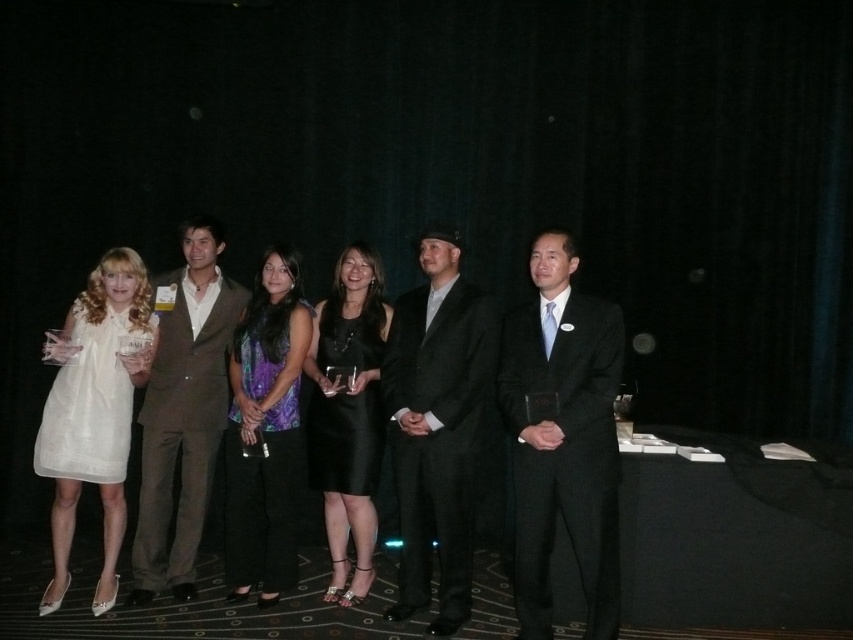
Question: Which point is farther to the camera?

Choices:
 (A) (357, 308)
 (B) (592, 522)
 (C) (105, 353)
 (D) (328, 435)

Answer: (A)

Question: Is brown wool suit at center to the right of black satin dress at center from the viewer's perspective?

Choices:
 (A) yes
 (B) no

Answer: (B)

Question: Is black suit at center behind brown wool suit at center?

Choices:
 (A) no
 (B) yes

Answer: (A)

Question: Which of the following is the farthest from the observer?

Choices:
 (A) (172, 481)
 (B) (73, 320)

Answer: (A)

Question: Does purple satin blouse at center appear on the left side of white lace dress at left?

Choices:
 (A) no
 (B) yes

Answer: (A)

Question: Which object is closer to the camera taking this photo?

Choices:
 (A) satin black dress at center
 (B) black suit at center
 (C) white sheer dress at left

Answer: (B)